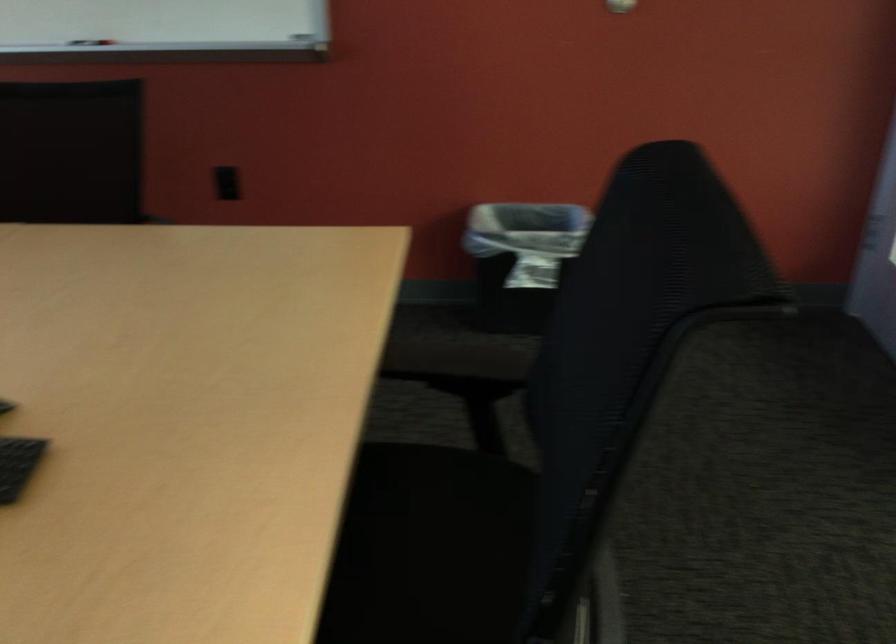
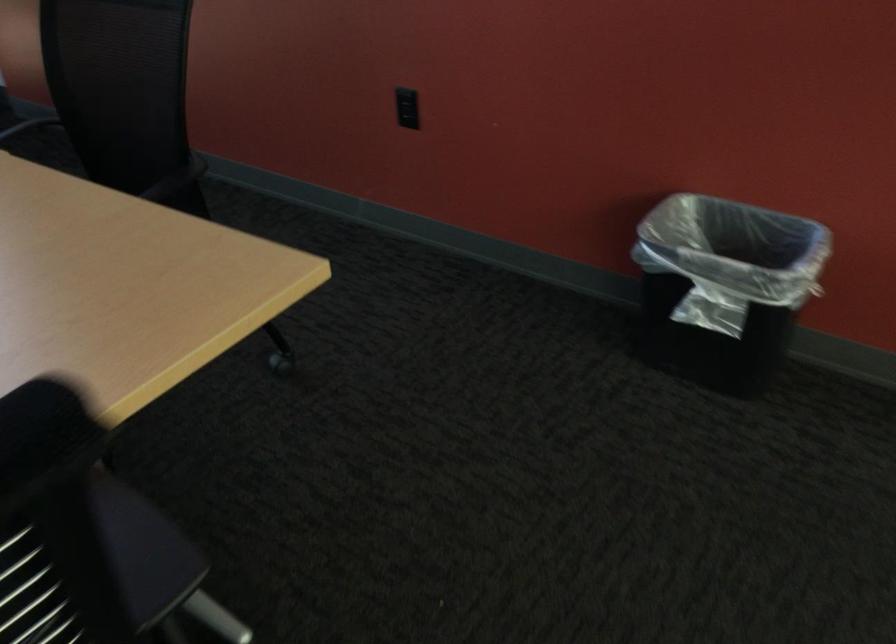
Question: I am providing you with two images of the same scene from different viewpoints. Please identify which objects are invisible in image2.

Choices:
 (A) black electrical outlet
 (B) black chair armrest
 (C) metal dispenser handle
 (D) black trash can

Answer: (B)